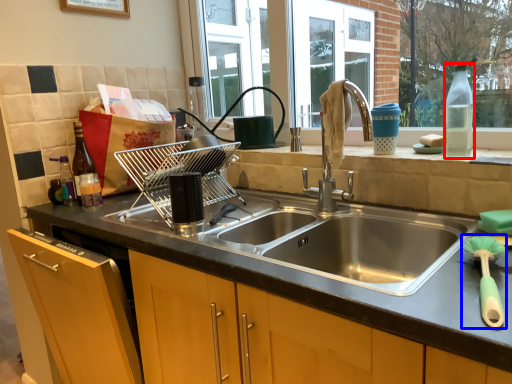
Question: Among these objects, which one is nearest to the camera, bottle (highlighted by a red box) or brush (highlighted by a blue box)?

Choices:
 (A) bottle
 (B) brush

Answer: (B)